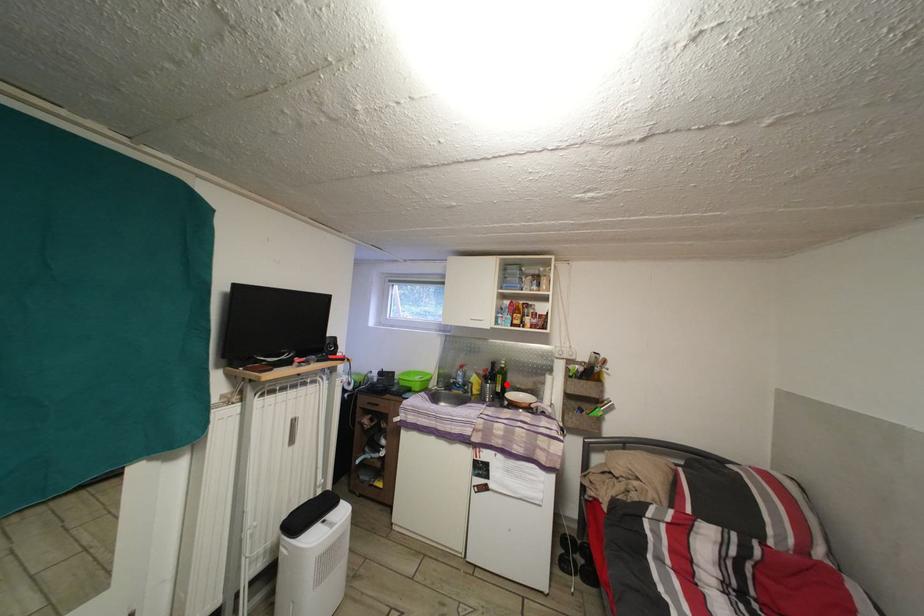
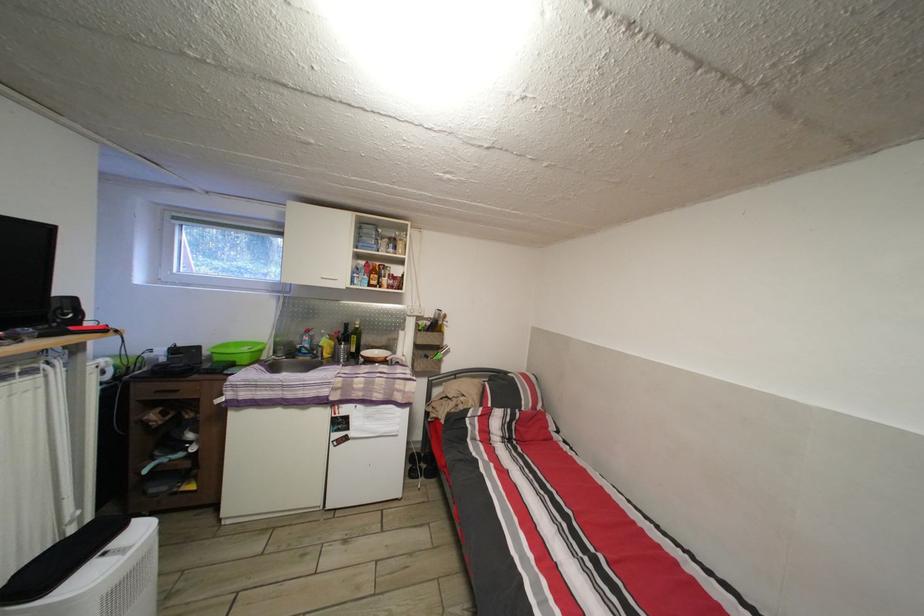
Locate, in the second image, the point that corresponds to the highlighted location in the first image.

(360, 345)